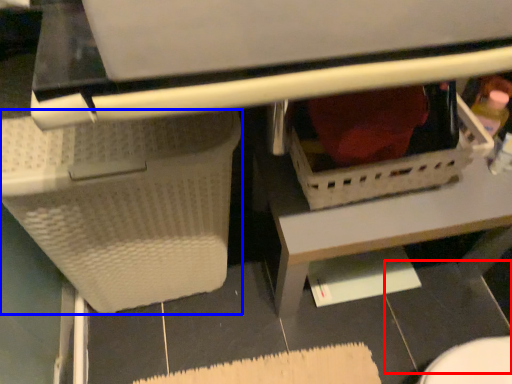
Question: Among these objects, which one is nearest to the camera, tile (highlighted by a red box) or basket (highlighted by a blue box)?

Choices:
 (A) tile
 (B) basket

Answer: (B)